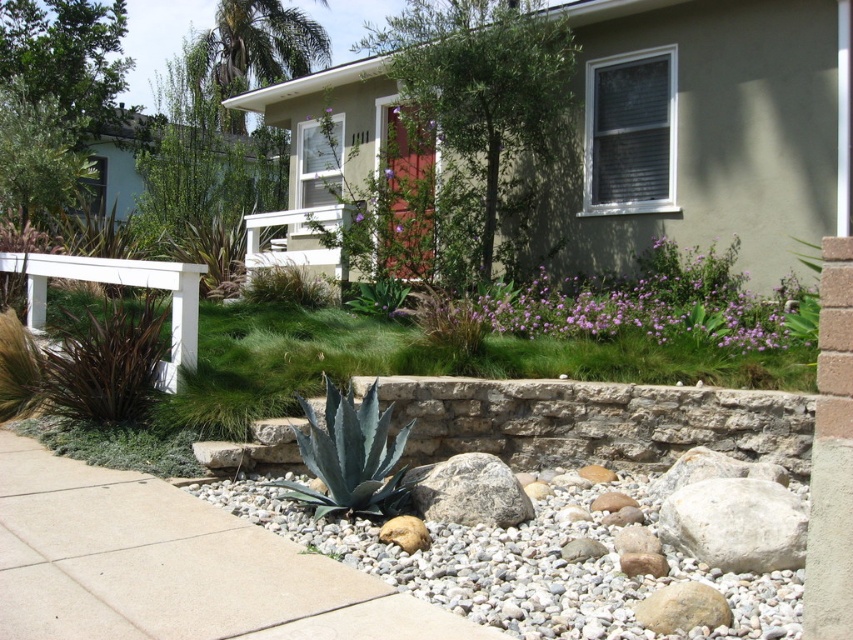
Question: Is white concrete path at center closer to the viewer compared to purple matte flower at center?

Choices:
 (A) no
 (B) yes

Answer: (B)

Question: Does white smooth rock at lower right have a lesser width compared to purple matte flower at center?

Choices:
 (A) no
 (B) yes

Answer: (A)

Question: Based on their relative distances, which object is nearer to the purple matte flower at center?

Choices:
 (A) gray rough rock at center
 (B) gray gravel at lower center

Answer: (A)

Question: Which of the following is the farthest from the observer?

Choices:
 (A) gray rough rock at center
 (B) purple soft flower at center

Answer: (B)

Question: Among these objects, which one is nearest to the camera?

Choices:
 (A) white concrete path at center
 (B) gray rough rock at center
 (C) purple matte flowers at center

Answer: (A)

Question: Where is white concrete path at center located in relation to gray gravel at lower center in the image?

Choices:
 (A) above
 (B) below

Answer: (A)